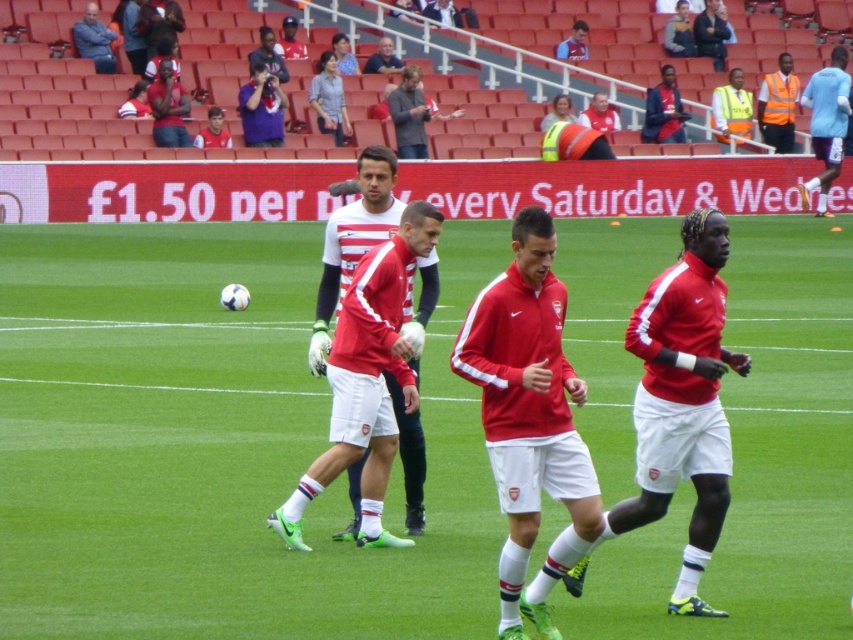
You are a photographer positioned at the center of the field. You want to take a photo of the light blue jersey at center. Which direction should you aim your camera to capture the jersey?

The light blue jersey at center is located at point 0.195 on the x and 0.970 on the y coordinates. Since you are at the center, aiming towards the lower right direction would capture the jersey.

You are a photographer at the soccer training session. You need to position your camera to capture the players in the foreground and the advertisement board in the background. Is the purple fabric camera at upper center currently positioned to include both the players and the advertisement board in the frame?

The purple fabric camera at upper center is located at point (260, 108), which places it in the upper center area. Since the players are in the foreground and the advertisement board is in the background, the camera position should allow both elements to be in the frame if the lens is appropriately adjusted. However, without specific lens details, we can infer that the upper center position likely captures both areas as they are vertically aligned.